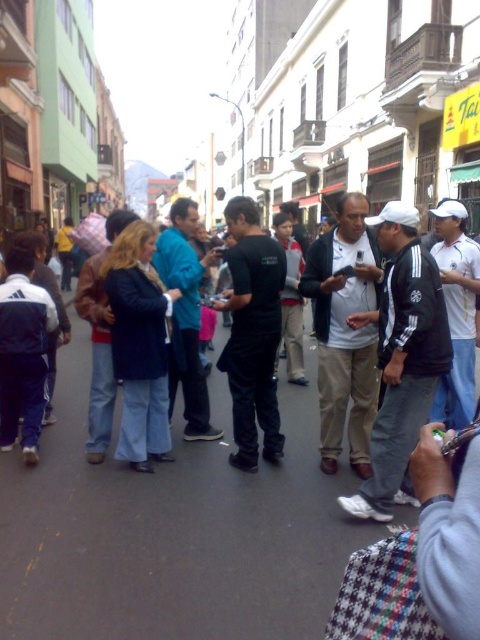
Question: Does black matte shirt at center have a lesser width compared to blue denim jeans at center?

Choices:
 (A) no
 (B) yes

Answer: (B)

Question: Can you confirm if black matte shirt at center is positioned below blue denim jeans at center?

Choices:
 (A) no
 (B) yes

Answer: (B)

Question: Which of the following is the closest to the observer?

Choices:
 (A) black matte shirt at center
 (B) blue denim jeans at center

Answer: (B)

Question: Can you confirm if black matte shirt at center is positioned to the right of blue denim jeans at center?

Choices:
 (A) no
 (B) yes

Answer: (B)